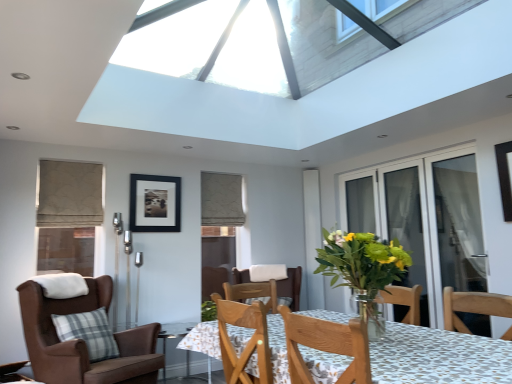
This screenshot has width=512, height=384. Describe the element at coordinates (83, 341) in the screenshot. I see `brown leather chair at left` at that location.

I want to click on transparent glass door at right, placed as the 2th screen door when sorted from back to front, so click(x=459, y=224).

At what (x,y) coordinates should I click in order to perform the action: click on brown leather chair at left. Please return your answer as a coordinate pair (x, y). Looking at the image, I should click on (83, 341).

How distant is transparent glass door at right, the 1th screen door positioned from the front, from patterned fabric table at center?

transparent glass door at right, the 1th screen door positioned from the front, is 7.09 feet away from patterned fabric table at center.

From the image's perspective, who appears lower, transparent glass door at right, the 1th screen door positioned from the front, or patterned fabric table at center?

patterned fabric table at center appears lower in the image.

Would you say transparent glass door at right, the 1th screen door positioned from the front, contains patterned fabric table at center?

No.

Does transparent glass door at right, placed as the 2th screen door when sorted from back to front, have a greater height compared to patterned fabric table at center?

Indeed, transparent glass door at right, placed as the 2th screen door when sorted from back to front, has a greater height compared to patterned fabric table at center.

Considering the positions of objects patterned fabric table at center and transparent glass door at right, placed as the 2th screen door when sorted from back to front, in the image provided, who is in front, patterned fabric table at center or transparent glass door at right, placed as the 2th screen door when sorted from back to front,?

patterned fabric table at center is in front.

Is point (272, 348) more distant than point (455, 182)?

No, (272, 348) is closer to viewer.

Can transparent glass door at right, the 1th screen door positioned from the front, be found inside patterned fabric table at center?

That's incorrect, transparent glass door at right, the 1th screen door positioned from the front, is not inside patterned fabric table at center.

From a real-world perspective, is patterned fabric table at center above or below transparent glass door at right, the 1th screen door positioned from the front?

In terms of real-world spatial position, patterned fabric table at center is below transparent glass door at right, the 1th screen door positioned from the front.

Based on the photo, how different are the orientations of transparent glass door at right, placed as the 2th screen door when sorted from back to front, and beige textured curtain at upper center in degrees?

The facing directions of transparent glass door at right, placed as the 2th screen door when sorted from back to front, and beige textured curtain at upper center are 90.3 degrees apart.

Is transparent glass door at right, placed as the 2th screen door when sorted from back to front, at the left side of beige textured curtain at upper center?

In fact, transparent glass door at right, placed as the 2th screen door when sorted from back to front, is to the right of beige textured curtain at upper center.

Consider the image. Is transparent glass door at right, placed as the 2th screen door when sorted from back to front, positioned beyond the bounds of beige textured curtain at upper center?

Absolutely, transparent glass door at right, placed as the 2th screen door when sorted from back to front, is external to beige textured curtain at upper center.

Is transparent glass door at right, placed as the 2th screen door when sorted from back to front, bigger or smaller than beige textured curtain at upper center?

Clearly, transparent glass door at right, placed as the 2th screen door when sorted from back to front, is smaller in size than beige textured curtain at upper center.

Considering the relative sizes of brown leather chair at left and transparent glass door at right, the 1th screen door positioned from the front, in the image provided, is brown leather chair at left smaller than transparent glass door at right, the 1th screen door positioned from the front,?

Incorrect, brown leather chair at left is not smaller in size than transparent glass door at right, the 1th screen door positioned from the front.

Considering the relative sizes of brown leather chair at left and transparent glass door at right, the 1th screen door positioned from the front, in the image provided, is brown leather chair at left taller than transparent glass door at right, the 1th screen door positioned from the front,?

In fact, brown leather chair at left may be shorter than transparent glass door at right, the 1th screen door positioned from the front.

From a real-world perspective, which object stands above the other?

transparent glass door at right, the 1th screen door positioned from the front, is physically above.

Are brown leather chair at left and transparent glass door at right, the 1th screen door positioned from the front, located far from each other?

Absolutely, brown leather chair at left is distant from transparent glass door at right, the 1th screen door positioned from the front.

Considering the sizes of objects brown leather chair at left and black matte picture frame at upper center in the image provided, who is wider, brown leather chair at left or black matte picture frame at upper center?

brown leather chair at left is wider.

Does brown leather chair at left appear on the left side of black matte picture frame at upper center?

Yes, brown leather chair at left is to the left of black matte picture frame at upper center.

From the image's perspective, would you say brown leather chair at left is shown under black matte picture frame at upper center?

Indeed, from the image's perspective, brown leather chair at left is shown beneath black matte picture frame at upper center.

Could you tell me if brown leather chair at left is turned towards black matte picture frame at upper center?

No, brown leather chair at left does not turn towards black matte picture frame at upper center.

Which is in front, beige textured curtain at upper center or transparent glass door at right, placed as the 2th screen door when sorted from back to front?

transparent glass door at right, placed as the 2th screen door when sorted from back to front.

How different are the orientations of beige textured curtain at upper center and transparent glass door at right, placed as the 2th screen door when sorted from back to front, in degrees?

beige textured curtain at upper center and transparent glass door at right, placed as the 2th screen door when sorted from back to front, are facing 90.3 degrees away from each other.

Does beige textured curtain at upper center have a larger size compared to transparent glass door at right, placed as the 2th screen door when sorted from back to front?

Correct, beige textured curtain at upper center is larger in size than transparent glass door at right, placed as the 2th screen door when sorted from back to front.

Is beige textured curtain at upper center outside of transparent glass door at right, placed as the 2th screen door when sorted from back to front?

That's correct, beige textured curtain at upper center is outside of transparent glass door at right, placed as the 2th screen door when sorted from back to front.

Could you tell me if beige textured curtain at upper center is turned towards transparent glass table at lower center?

No, beige textured curtain at upper center is not facing towards transparent glass table at lower center.

Where is `glass table below the beige textured curtain at upper center (from the image's perspective)`? glass table below the beige textured curtain at upper center (from the image's perspective) is located at coordinates (194, 375).

Considering their positions, is beige textured curtain at upper center located in front of or behind transparent glass table at lower center?

beige textured curtain at upper center is behind transparent glass table at lower center.

The image size is (512, 384). Find the location of `table below the transparent glass door at right, the 1th screen door positioned from the front (from the image's perspective)`. table below the transparent glass door at right, the 1th screen door positioned from the front (from the image's perspective) is located at coordinates (438, 357).

Which screen door is the 2nd one when counting from the right side of the patterned fabric table at center? Please provide its 2D coordinates.

[(459, 224)]

Which object lies nearer to the anchor point beige textured curtain at upper center, patterned fabric table at center or black matte picture frame at upper center?

Among the two, black matte picture frame at upper center is located nearer to beige textured curtain at upper center.

Estimate the real-world distances between objects in this image. Which object is further from transparent glass screen door at right, acting as the first screen door starting from the back, transparent glass table at lower center or black matte picture frame at upper center?

black matte picture frame at upper center is positioned further to the anchor transparent glass screen door at right, acting as the first screen door starting from the back.

From the image, which object appears to be nearer to brown leather chair at left, patterned fabric table at center or transparent glass door at right, placed as the 2th screen door when sorted from back to front?

patterned fabric table at center is closer to brown leather chair at left.

Estimate the real-world distances between objects in this image. Which object is closer to transparent glass screen door at right, acting as the first screen door starting from the back, translucent glass vase at center or black matte picture frame at upper center?

The object closer to transparent glass screen door at right, acting as the first screen door starting from the back, is translucent glass vase at center.

Consider the image. Estimate the real-world distances between objects in this image. Which object is closer to beige textured curtain at upper center, patterned fabric table at center or transparent glass door at right, placed as the 2th screen door when sorted from back to front?

transparent glass door at right, placed as the 2th screen door when sorted from back to front, is closer to beige textured curtain at upper center.

Looking at the image, which one is located further to transparent glass door at right, the 1th screen door positioned from the front, transparent glass table at lower center or brown leather chair at left?

Based on the image, brown leather chair at left appears to be further to transparent glass door at right, the 1th screen door positioned from the front.

Based on their spatial positions, is beige textured curtain at upper center or translucent glass vase at center closer to black matte picture frame at upper center?

The object closer to black matte picture frame at upper center is beige textured curtain at upper center.

Considering their positions, is black matte picture frame at upper center positioned closer to patterned fabric table at center than transparent glass door at right, placed as the 2th screen door when sorted from back to front?

transparent glass door at right, placed as the 2th screen door when sorted from back to front, is closer to patterned fabric table at center.

At what (x,y) coordinates should I click in order to perform the action: click on picture frame between brown leather chair at left and transparent glass screen door at right, the second screen door when ordered from front to back, in the horizontal direction. Please return your answer as a coordinate pair (x, y). Image resolution: width=512 pixels, height=384 pixels. Looking at the image, I should click on (155, 203).

This screenshot has width=512, height=384. Identify the location of chair between patterned fabric table at center and black matte picture frame at upper center from front to back. (83, 341).

At what (x,y) coordinates should I click in order to perform the action: click on houseplant between brown leather chair at left and transparent glass screen door at right, acting as the first screen door starting from the back, from left to right. Please return your answer as a coordinate pair (x, y). The width and height of the screenshot is (512, 384). Looking at the image, I should click on (362, 269).

Identify the location of chair between patterned fabric table at center and beige textured curtain at upper center along the z-axis. The width and height of the screenshot is (512, 384). (83, 341).